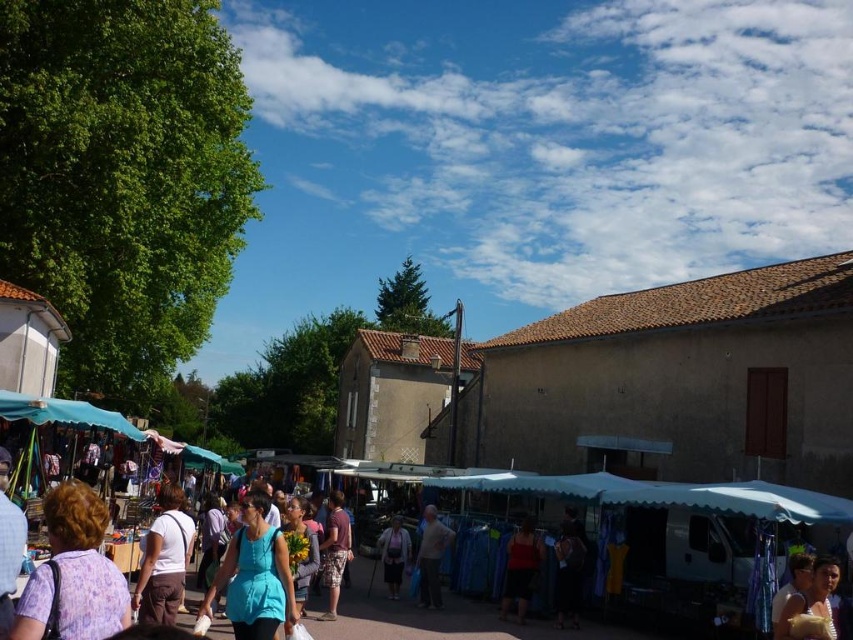
You are a customer at the market and want to buy a purple fabric dress at lower left and a matte blue shirt at center. The vendor tells you that the dress is narrower than the shirt. Which item would require more space when packing them separately?

The purple fabric dress at lower left has a lesser width compared to the matte blue shirt at center, so the matte blue shirt at center would require more space when packing them separately.

You are a customer standing at the entrance of the market and want to reach the stall located at point (408, 538). There is an obstacle at point (76, 570). Will you need to go around the obstacle to reach your destination?

Point (76, 570) is in front of point (408, 538), so the obstacle is blocking the path. You will need to go around the obstacle to reach the stall at point (408, 538).

You are a customer at the market and want to buy a dress. You see the purple fabric dress at lower left and the matte purple dress at center. Which dress is wider?

The purple fabric dress at lower left is wider than the matte purple dress at center.